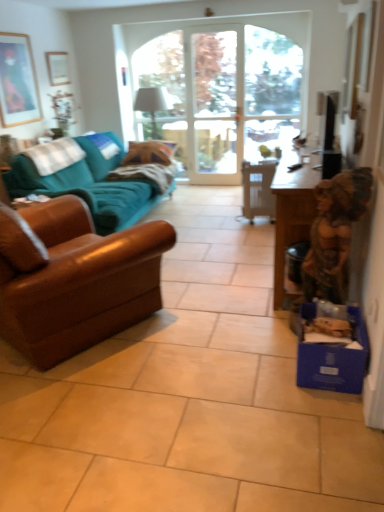
Question: Considering the relative positions of teal fabric couch at left, which ranks as the 2th studio couch in front-to-back order, and brown leather couch at left, the first studio couch in the front-to-back sequence, in the image provided, is teal fabric couch at left, which ranks as the 2th studio couch in front-to-back order, to the left or to the right of brown leather couch at left, the first studio couch in the front-to-back sequence,?

Choices:
 (A) left
 (B) right

Answer: (A)

Question: Considering the positions of teal fabric couch at left, which is the 1th studio couch in back-to-front order, and brown leather couch at left, the first studio couch in the front-to-back sequence, in the image, is teal fabric couch at left, which is the 1th studio couch in back-to-front order, bigger or smaller than brown leather couch at left, the first studio couch in the front-to-back sequence,?

Choices:
 (A) small
 (B) big

Answer: (B)

Question: Estimate the real-world distances between objects in this image. Which object is closer to the clear glass door at center?

Choices:
 (A) plush white pillow at left
 (B) blue cardboard box at lower right
 (C) brown leather couch at left, the first studio couch in the front-to-back sequence
 (D) white plastic chair at center
 (E) wooden table at right

Answer: (D)

Question: Estimate the real-world distances between objects in this image. Which object is closer to the white plastic chair at center?

Choices:
 (A) plush white pillow at left
 (B) wooden table at right
 (C) blue cardboard box at lower right
 (D) brown leather couch at left, the first studio couch in the front-to-back sequence
 (E) clear glass door at center

Answer: (B)